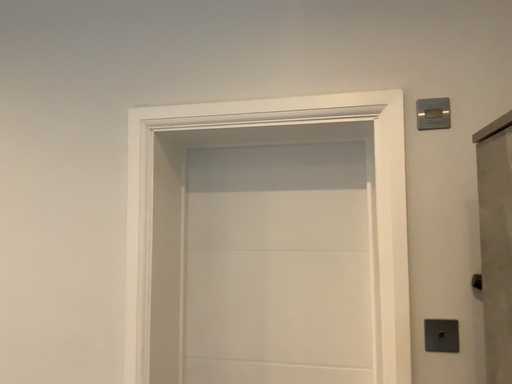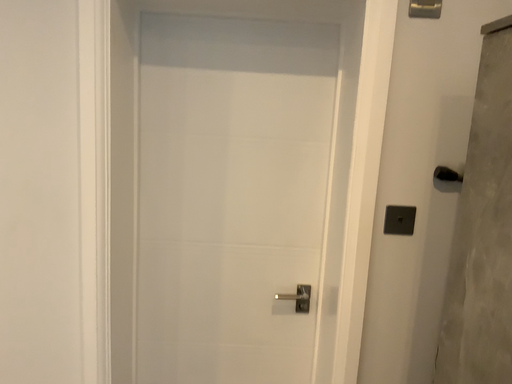
Question: How did the camera likely rotate when shooting the video?

Choices:
 (A) rotated downward
 (B) rotated upward

Answer: (A)